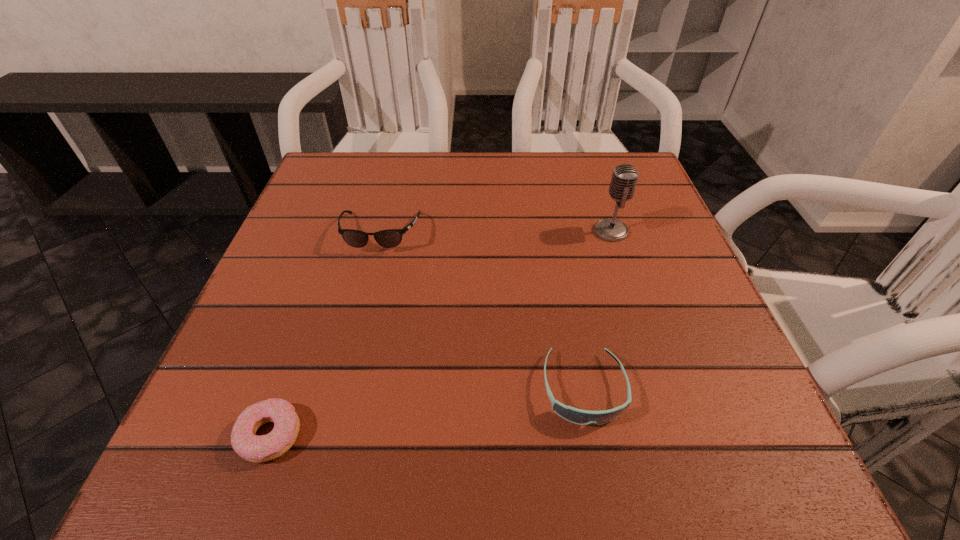
The height and width of the screenshot is (540, 960). In order to click on free spot at the far right corner of the desktop in this screenshot , I will do `click(633, 201)`.

The height and width of the screenshot is (540, 960). Find the location of `empty location between the microphone and the third object from left to right`. empty location between the microphone and the third object from left to right is located at coordinates (597, 310).

This screenshot has height=540, width=960. What are the coordinates of `empty space that is in between the shortest object and the third object from left to right` in the screenshot? It's located at (426, 412).

The width and height of the screenshot is (960, 540). Find the location of `free area in between the shortest object and the goggles`. free area in between the shortest object and the goggles is located at coordinates (426, 412).

You are a GUI agent. You are given a task and a screenshot of the screen. Output one action in this format:
    pyautogui.click(x=<x>, y=<y>)
    Task: Click on the free space between the third shortest object and the doughnut
    
    Given the screenshot: What is the action you would take?
    pyautogui.click(x=325, y=334)

You are a GUI agent. You are given a task and a screenshot of the screen. Output one action in this format:
    pyautogui.click(x=<x>, y=<y>)
    Task: Click on the empty space that is in between the sunglasses and the shortest object
    
    Given the screenshot: What is the action you would take?
    pyautogui.click(x=325, y=334)

You are a GUI agent. You are given a task and a screenshot of the screen. Output one action in this format:
    pyautogui.click(x=<x>, y=<y>)
    Task: Click on the vacant area that lies between the sunglasses and the third tallest object
    This screenshot has height=540, width=960.
    Given the screenshot: What is the action you would take?
    pyautogui.click(x=482, y=311)

Identify the location of vacant area between the microphone and the doughnut. The image size is (960, 540). (441, 333).

At what (x,y) coordinates should I click in order to perform the action: click on free spot between the rightmost object and the third shortest object. Please return your answer as a coordinate pair (x, y). Looking at the image, I should click on (495, 232).

Image resolution: width=960 pixels, height=540 pixels. I want to click on vacant area that lies between the rightmost object and the second object from right to left, so click(x=597, y=310).